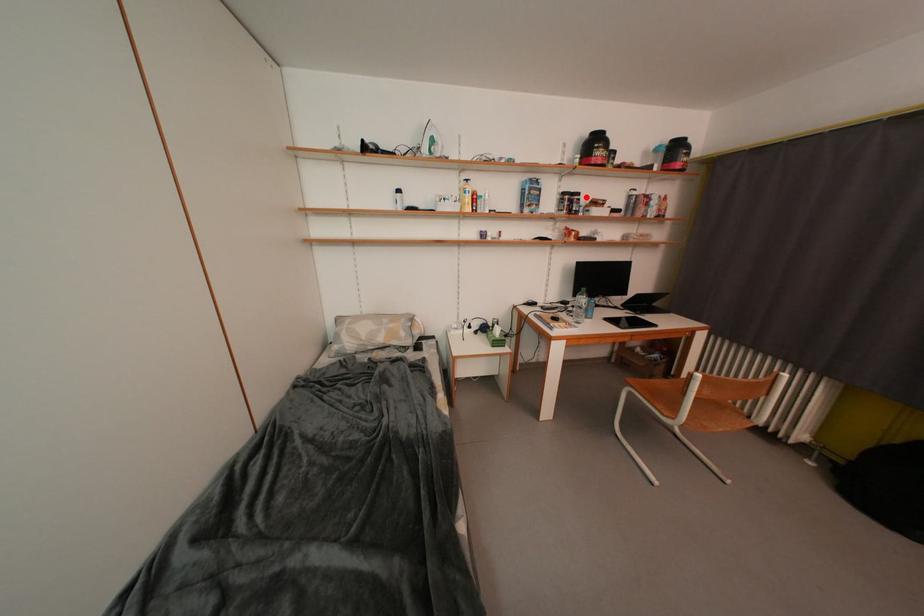
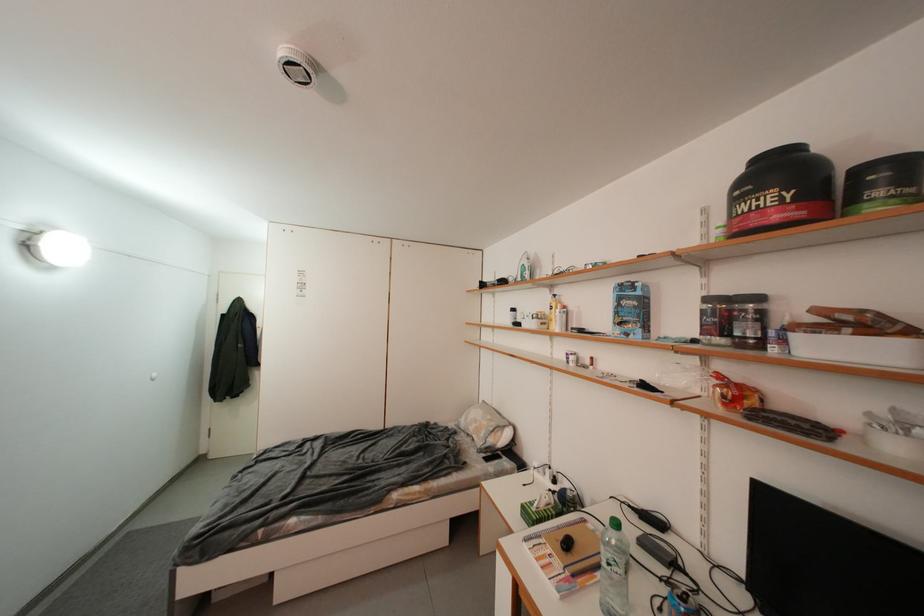
Question: I am providing you with two images of the same scene from different viewpoints. In image1, a red point is highlighted. Considering the same 3D point in image2, which of the following is correct?

Choices:
 (A) It is closer
 (B) It is farther

Answer: (B)